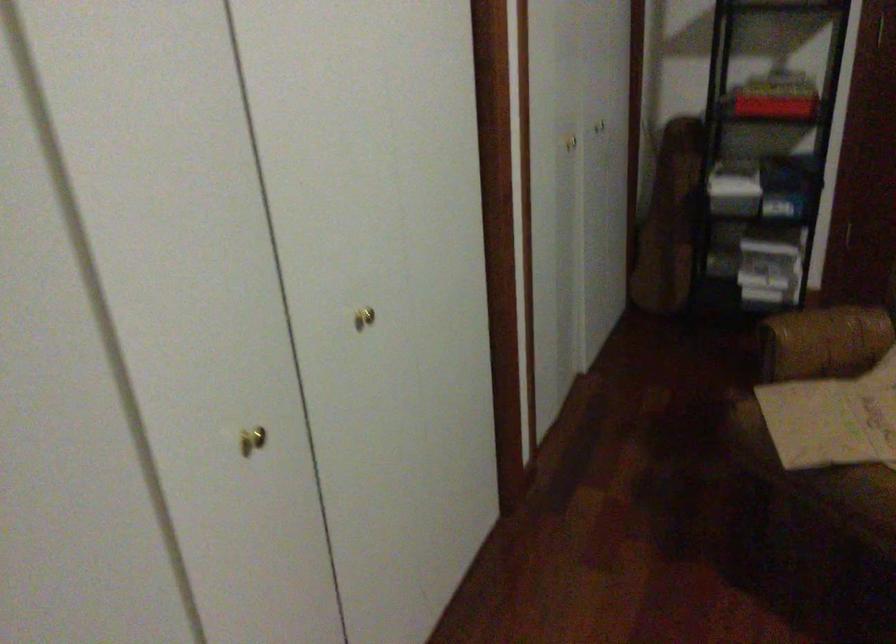
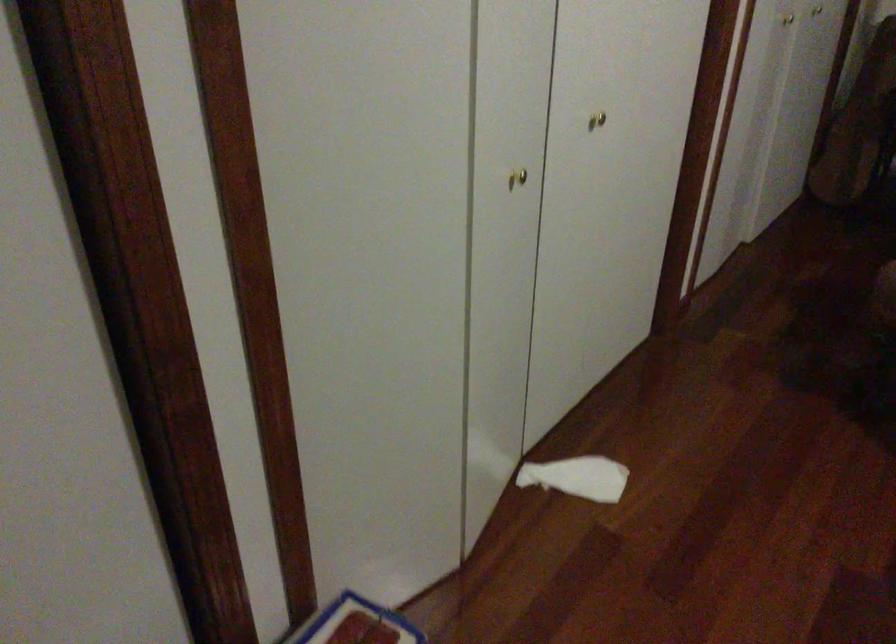
Question: In a continuous first-person perspective shot, in which direction is the camera moving?

Choices:
 (A) Left
 (B) Right
 (C) Forward
 (D) Backward

Answer: (D)